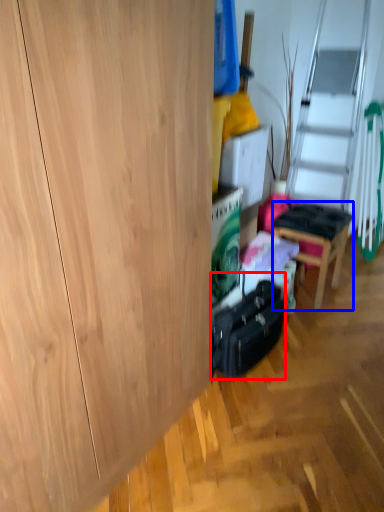
Question: Among these objects, which one is farthest to the camera, luggage (highlighted by a red box) or chair (highlighted by a blue box)?

Choices:
 (A) luggage
 (B) chair

Answer: (B)